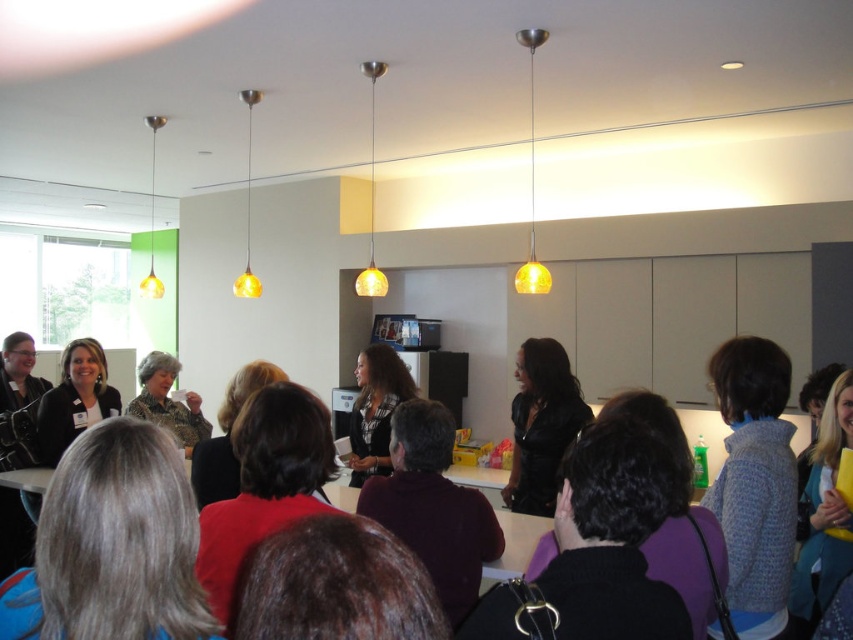
Question: Can you confirm if gray hair at center is positioned above matte black jacket at center?

Choices:
 (A) yes
 (B) no

Answer: (A)

Question: Which point appears closest to the camera in this image?

Choices:
 (A) (306, 506)
 (B) (141, 522)
 (C) (402, 400)
 (D) (151, 376)

Answer: (B)

Question: Does knitted blue sweater at right have a greater width compared to camouflage-patterned blouse at center?

Choices:
 (A) yes
 (B) no

Answer: (B)

Question: In this image, where is dark purple sweater at center located relative to amber glass pendant light at upper left?

Choices:
 (A) left
 (B) right

Answer: (B)

Question: Which point appears closest to the camera in this image?

Choices:
 (A) 550,349
 (B) 76,609
 (C) 403,480

Answer: (B)

Question: Which of the following is the farthest from the observer?

Choices:
 (A) green matte pendant light at left
 (B) yellow glass pendant light at upper center
 (C) gray hair at center
 (D) dark purple sweater at center

Answer: (A)